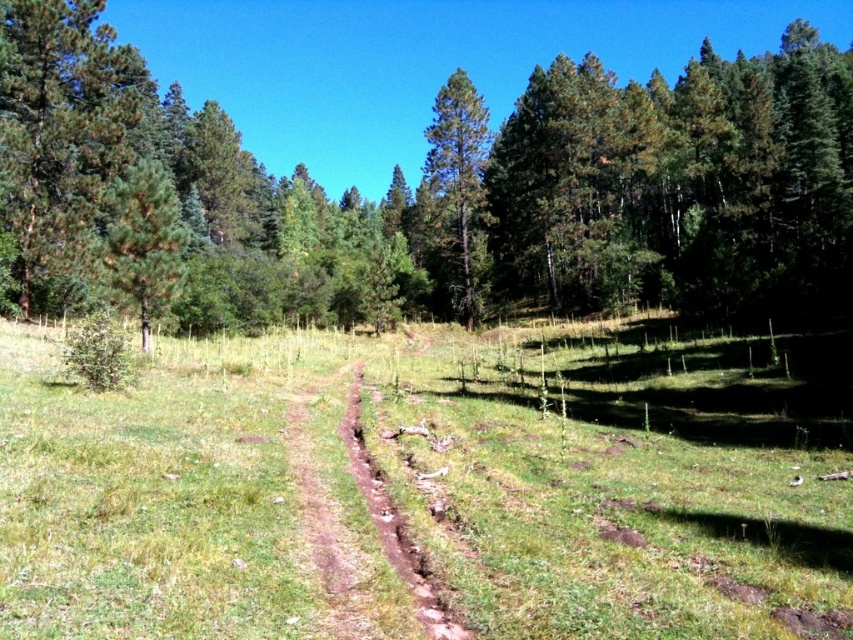
Can you confirm if green leafy forest at center is taller than green matte tree at center?

Correct, green leafy forest at center is much taller as green matte tree at center.

Does green leafy forest at center lie in front of green matte tree at center?

Yes, it is in front of green matte tree at center.

Who is more distant from viewer, (426, 132) or (476, 122)?

The point (426, 132) is behind.

I want to click on green leafy forest at center, so click(x=426, y=192).

Looking at this image, is green grassy at center bigger than green leafy forest at center?

No, green grassy at center is not bigger than green leafy forest at center.

Which is more to the left, green grassy at center or green leafy forest at center?

green grassy at center is more to the left.

This screenshot has height=640, width=853. Identify the location of green grassy at center. (431, 484).

Who is taller, green grassy at center or green matte tree at center?

green matte tree at center is taller.

Locate an element on the screen. green grassy at center is located at coordinates (431, 484).

Where is `green grassy at center`? The height and width of the screenshot is (640, 853). green grassy at center is located at coordinates (431, 484).

Locate an element on the screen. The width and height of the screenshot is (853, 640). green grassy at center is located at coordinates (431, 484).